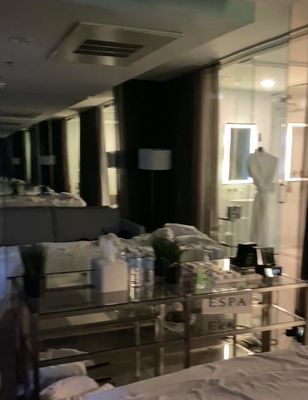
Identify the location of lights. This screenshot has height=400, width=308. (227, 166), (286, 160).